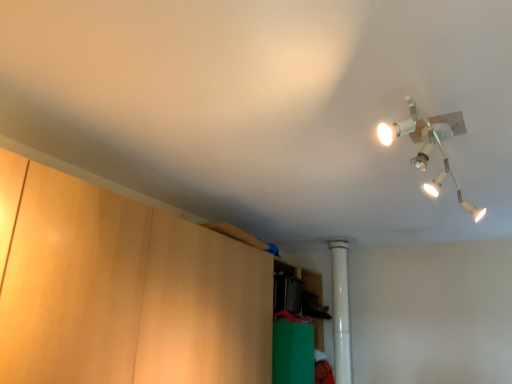
Question: Relative to white metallic lamp at upper right, is white plastic pipe at center in front or behind?

Choices:
 (A) behind
 (B) front

Answer: (A)

Question: In terms of height, does white plastic pipe at center look taller or shorter compared to white metallic lamp at upper right?

Choices:
 (A) short
 (B) tall

Answer: (B)

Question: Considering the real-world distances, which object is closest to the green matte cabinet at lower center, which ranks as the 2th cabinetry in front-to-back order?

Choices:
 (A) white metallic lamp at upper right
 (B) white plastic pipe at center
 (C) wooden cabinet at left, the 1th cabinetry viewed from the front

Answer: (B)

Question: Estimate the real-world distances between objects in this image. Which object is farther from the white plastic pipe at center?

Choices:
 (A) white metallic lamp at upper right
 (B) green matte cabinet at lower center, which is the 1th cabinetry from back to front
 (C) wooden cabinet at left, which ranks as the 2th cabinetry in back-to-front order

Answer: (C)